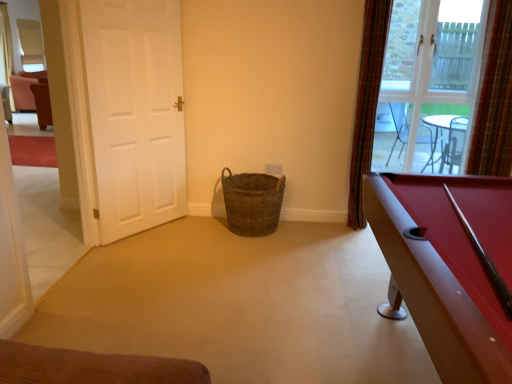
Question: Is white matte door at left taller or shorter than plaid fabric curtain at right, which is counted as the 2th curtain, starting from the right?

Choices:
 (A) short
 (B) tall

Answer: (A)

Question: From the image's perspective, relative to plaid fabric curtain at right, which appears as the 1th curtain when viewed from the left, is white matte door at left above or below?

Choices:
 (A) below
 (B) above

Answer: (A)

Question: Which object is the farthest from the rubberized red pool table at right?

Choices:
 (A) brown woven basket at center
 (B) plaid fabric curtain at upper right, which is the second curtain from left to right
 (C) clear glass window at upper right
 (D) white matte door at left
 (E) plaid fabric curtain at right, which appears as the 1th curtain when viewed from the left

Answer: (C)

Question: Estimate the real-world distances between objects in this image. Which object is farther from the clear glass window at upper right?

Choices:
 (A) white matte door at left
 (B) brown woven basket at center
 (C) plaid fabric curtain at right, which appears as the 1th curtain when viewed from the left
 (D) plaid fabric curtain at upper right, which is the second curtain from left to right
 (E) rubberized red pool table at right

Answer: (A)